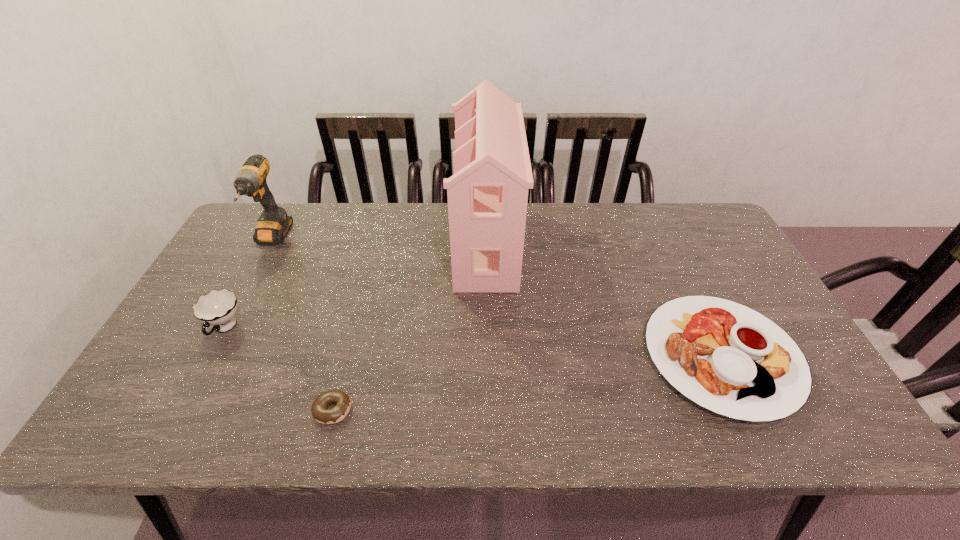
Image resolution: width=960 pixels, height=540 pixels. What are the coordinates of `free space that satisfies the following two spatial constraints: 1. on the side of the third shortest object with the handle; 2. on the right side of the platter` in the screenshot? It's located at coord(210,356).

Locate an element on the screen. vacant area that satisfies the following two spatial constraints: 1. on the front-facing side of the dollhouse; 2. on the left side of the fourth tallest object is located at coordinates (488, 356).

Where is `free region that satisfies the following two spatial constraints: 1. on the front-facing side of the rightmost object; 2. on the left side of the tallest object`? The image size is (960, 540). free region that satisfies the following two spatial constraints: 1. on the front-facing side of the rightmost object; 2. on the left side of the tallest object is located at coordinates (488, 356).

You are a GUI agent. You are given a task and a screenshot of the screen. Output one action in this format:
    pyautogui.click(x=<x>, y=<y>)
    Task: Click on the vacant space that satisfies the following two spatial constraints: 1. with the drill bit of the shortest object facing forward; 2. on the left side of the drill
    The height and width of the screenshot is (540, 960).
    Given the screenshot: What is the action you would take?
    pyautogui.click(x=180, y=409)

The height and width of the screenshot is (540, 960). I want to click on vacant position in the image that satisfies the following two spatial constraints: 1. with the drill bit of the shortest object facing forward; 2. on the right side of the drill, so (180, 409).

Where is `vacant area that satisfies the following two spatial constraints: 1. with the drill bit of the shortest object facing forward; 2. on the left side of the drill`? vacant area that satisfies the following two spatial constraints: 1. with the drill bit of the shortest object facing forward; 2. on the left side of the drill is located at coordinates (180, 409).

Identify the location of vacant space that satisfies the following two spatial constraints: 1. on the side of the cup with the handle; 2. on the right side of the fourth tallest object. The width and height of the screenshot is (960, 540). (210, 356).